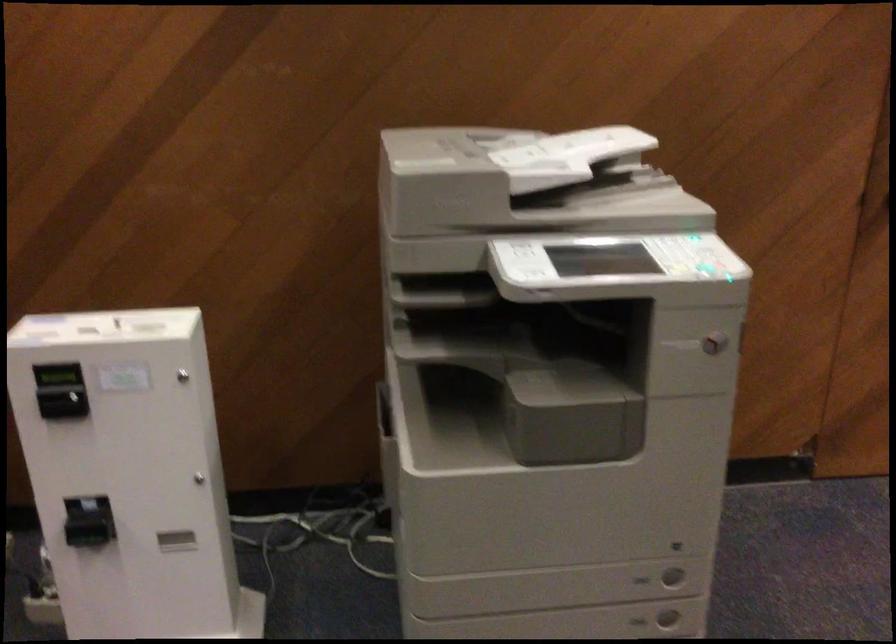
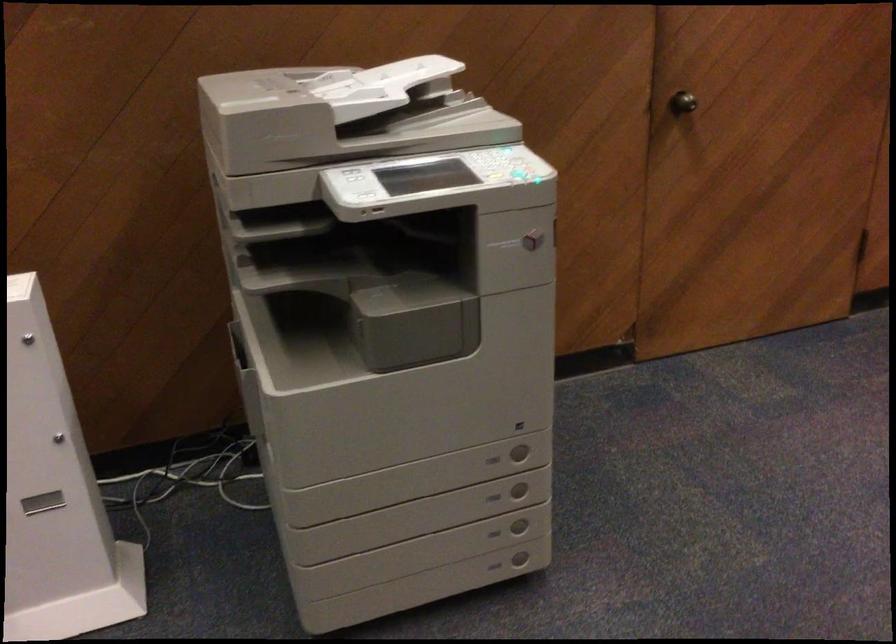
The point at (710, 267) is marked in the first image. Where is the corresponding point in the second image?

(521, 176)